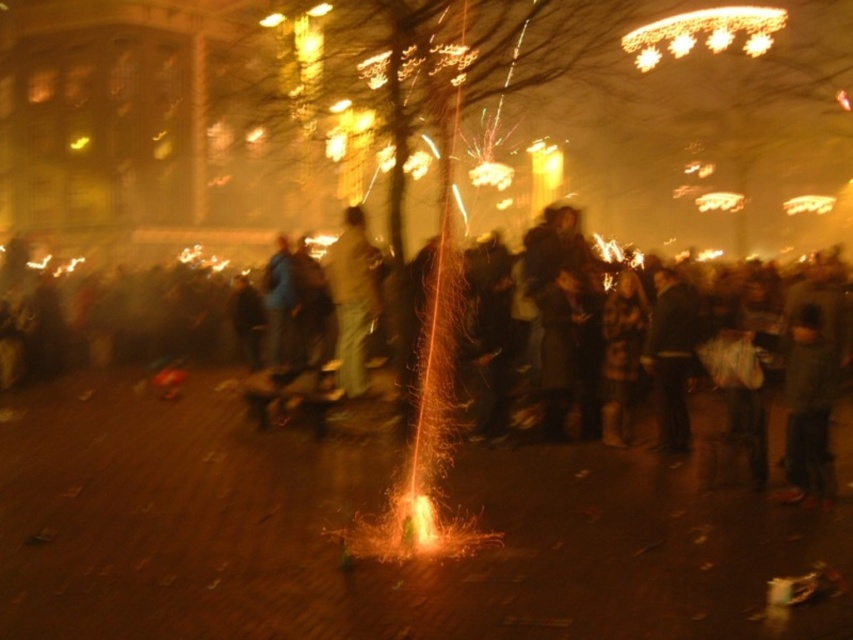
Does dark gray sweater at center appear on the right side of light brown leather jacket at center?

Indeed, dark gray sweater at center is positioned on the right side of light brown leather jacket at center.

Can you confirm if dark gray sweater at center is positioned to the left of light brown leather jacket at center?

Incorrect, dark gray sweater at center is not on the left side of light brown leather jacket at center.

Is point (666, 326) farther from camera compared to point (360, 246)?

No.

Identify the location of dark gray sweater at center. (671, 356).

Does dark clothing crowd at center come in front of dark gray sweater at center?

Yes.

Is dark clothing crowd at center to the left of dark gray sweater at center from the viewer's perspective?

Indeed, dark clothing crowd at center is positioned on the left side of dark gray sweater at center.

What do you see at coordinates (351, 324) in the screenshot? The height and width of the screenshot is (640, 853). I see `dark clothing crowd at center` at bounding box center [351, 324].

Identify the location of dark clothing crowd at center. The width and height of the screenshot is (853, 640). (351, 324).

Who is taller, dark clothing crowd at center or light brown leather jacket at center?

dark clothing crowd at center is taller.

Does dark clothing crowd at center have a lesser width compared to light brown leather jacket at center?

In fact, dark clothing crowd at center might be wider than light brown leather jacket at center.

Between point (625, 344) and point (358, 355), which one is positioned in front?

Point (625, 344) is in front.

Identify the location of dark clothing crowd at center. coord(351,324).